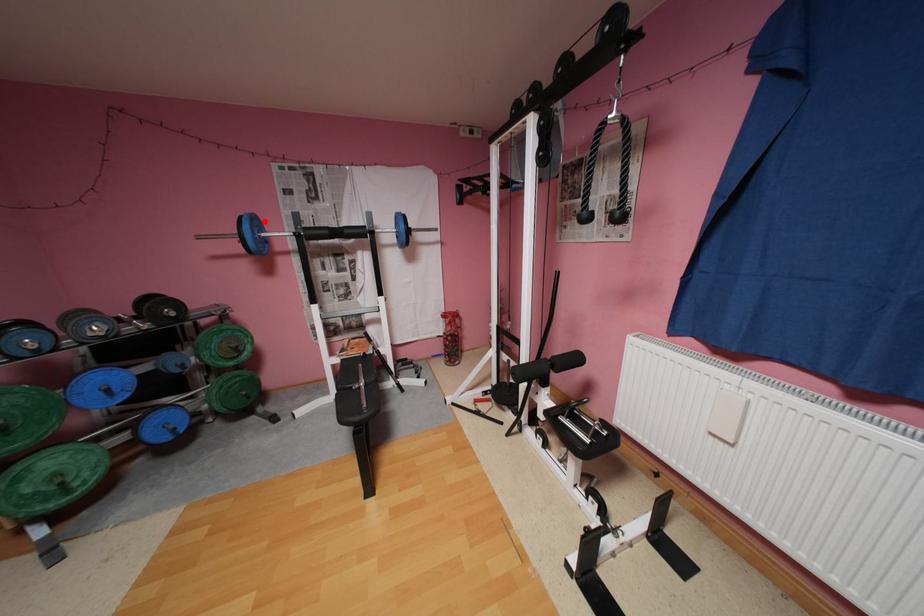
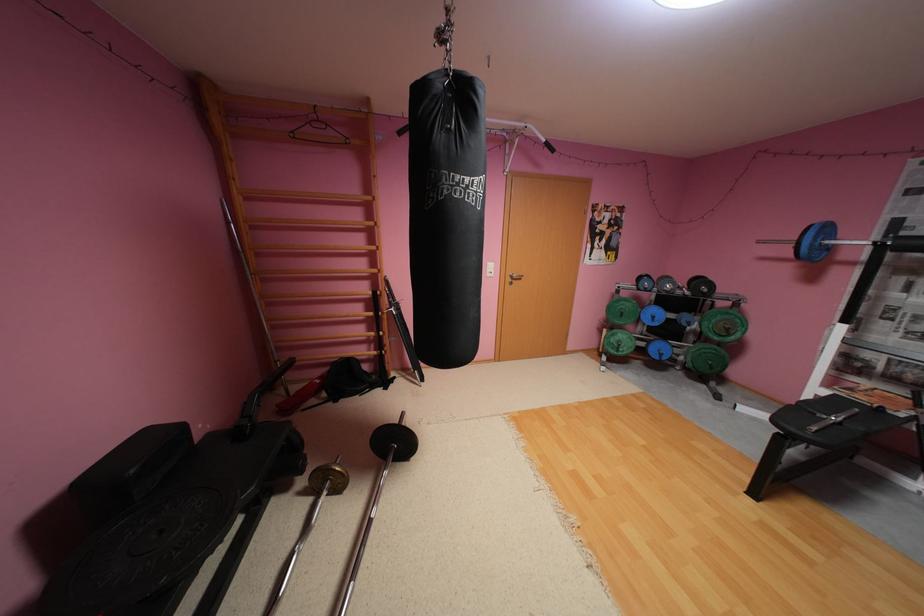
Find the pixel in the second image that matches the highlighted location in the first image.

(835, 229)